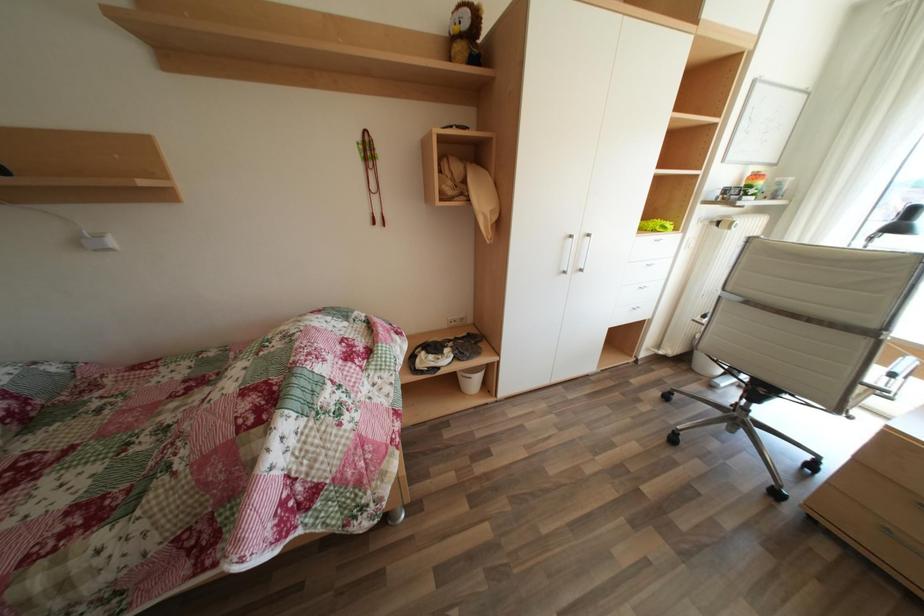
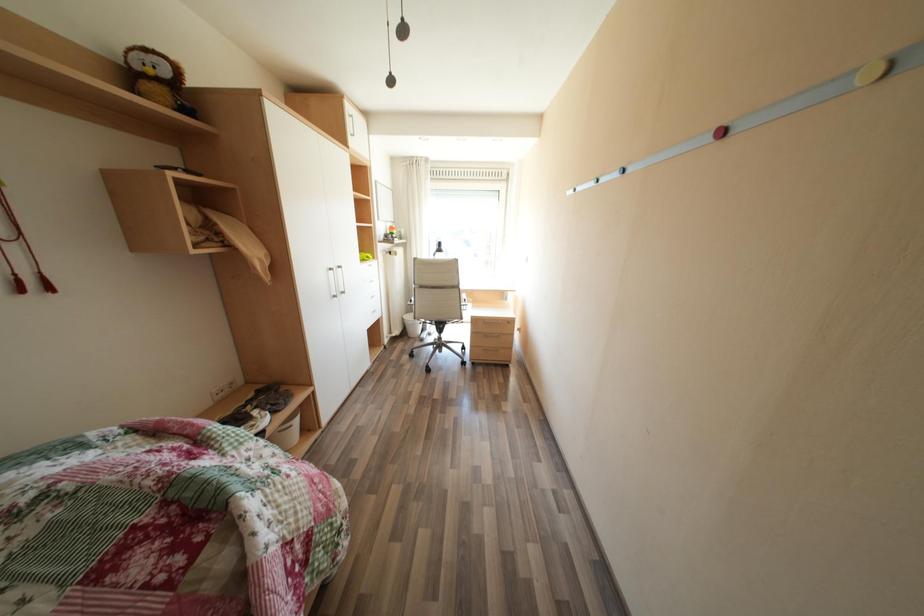
Question: The camera is either moving clockwise (left) or counter-clockwise (right) around the object. The first image is from the beginning of the video and the second image is from the end. Is the camera moving left or right when shooting the video?

Choices:
 (A) Left
 (B) Right

Answer: (A)